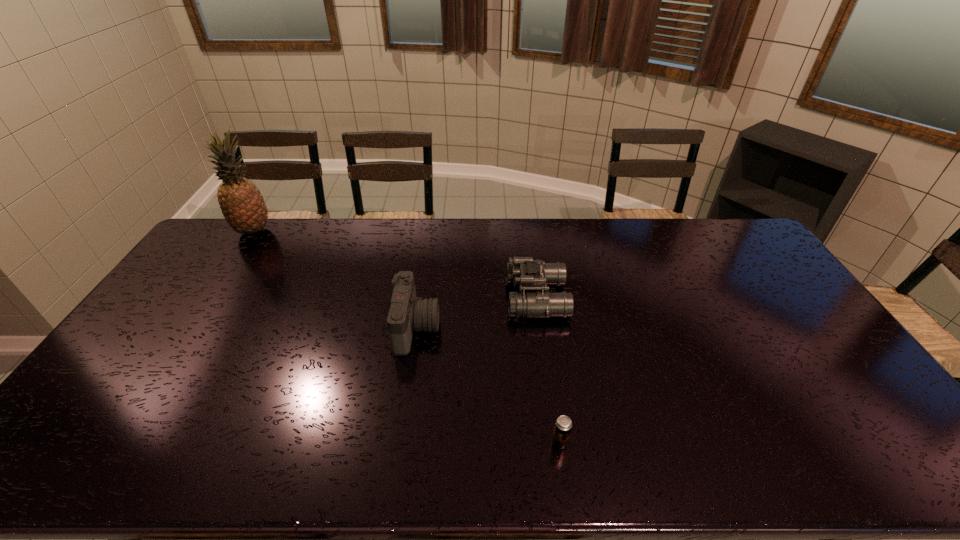
This screenshot has height=540, width=960. In order to click on free space located 0.290m through the lenses of the binoculars in this screenshot , I will do `click(419, 298)`.

This screenshot has height=540, width=960. In order to click on vacant region located on the right of the beer can in this screenshot , I will do `click(613, 442)`.

Where is `object located at the far edge`? object located at the far edge is located at coordinates (243, 206).

What are the coordinates of `object at the near edge` in the screenshot? It's located at (563, 425).

I want to click on object positioned at the left edge, so click(243, 206).

Where is `object that is at the far left corner`? object that is at the far left corner is located at coordinates (x=243, y=206).

Locate an element on the screen. vacant space at the far edge is located at coordinates (504, 240).

Identify the location of vacant region at the near edge of the desktop. The height and width of the screenshot is (540, 960). (814, 464).

Locate an element on the screen. The height and width of the screenshot is (540, 960). free space at the left edge of the desktop is located at coordinates tap(184, 273).

The image size is (960, 540). Identify the location of blank space at the right edge of the desktop. (766, 273).